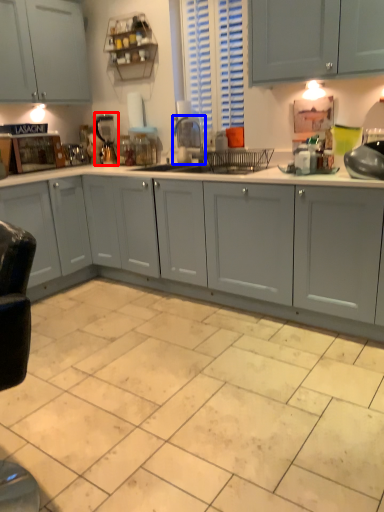
Question: Which object appears farthest to the camera in this image, appliance (highlighted by a red box) or appliance (highlighted by a blue box)?

Choices:
 (A) appliance
 (B) appliance

Answer: (A)